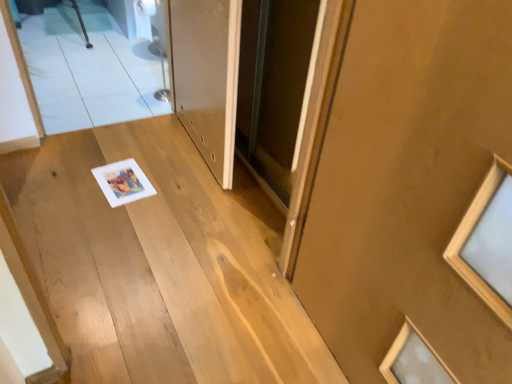
Question: Does wooden stairs at center appear on the left side of white glossy door at center, which ranks as the second door in front-to-back order?

Choices:
 (A) yes
 (B) no

Answer: (A)

Question: Does wooden stairs at center have a greater height compared to white glossy door at center, which ranks as the second door in front-to-back order?

Choices:
 (A) yes
 (B) no

Answer: (B)

Question: From the image's perspective, does wooden stairs at center appear higher than white glossy door at center, which ranks as the second door in front-to-back order?

Choices:
 (A) yes
 (B) no

Answer: (B)

Question: Considering the relative sizes of wooden stairs at center and white glossy door at center, the 2th door positioned from the right, in the image provided, is wooden stairs at center bigger than white glossy door at center, the 2th door positioned from the right,?

Choices:
 (A) yes
 (B) no

Answer: (A)

Question: Considering the relative positions of wooden stairs at center and white glossy door at center, which ranks as the second door in front-to-back order, in the image provided, is wooden stairs at center to the right of white glossy door at center, which ranks as the second door in front-to-back order, from the viewer's perspective?

Choices:
 (A) no
 (B) yes

Answer: (A)

Question: Does wooden stairs at center have a lesser height compared to white glossy door at center, which ranks as the second door in front-to-back order?

Choices:
 (A) yes
 (B) no

Answer: (A)

Question: Is white glossy door at center, which ranks as the second door in front-to-back order, looking in the opposite direction of clear glass mirror at upper left?

Choices:
 (A) yes
 (B) no

Answer: (B)

Question: Can you confirm if white glossy door at center, which ranks as the second door in front-to-back order, is wider than clear glass mirror at upper left?

Choices:
 (A) yes
 (B) no

Answer: (B)

Question: Is white glossy door at center, the 2th door positioned from the right, positioned far away from clear glass mirror at upper left?

Choices:
 (A) yes
 (B) no

Answer: (B)

Question: Does white glossy door at center, which is the 1th door from back to front, appear on the left side of clear glass mirror at upper left?

Choices:
 (A) yes
 (B) no

Answer: (B)

Question: From the image's perspective, is white glossy door at center, which ranks as the second door in front-to-back order, located beneath clear glass mirror at upper left?

Choices:
 (A) no
 (B) yes

Answer: (B)

Question: Could you tell me if white glossy door at center, which ranks as the second door in front-to-back order, is turned towards clear glass mirror at upper left?

Choices:
 (A) yes
 (B) no

Answer: (B)

Question: Is wooden stairs at center wider than matte brown door at center, which is the first door in right-to-left order?

Choices:
 (A) yes
 (B) no

Answer: (A)